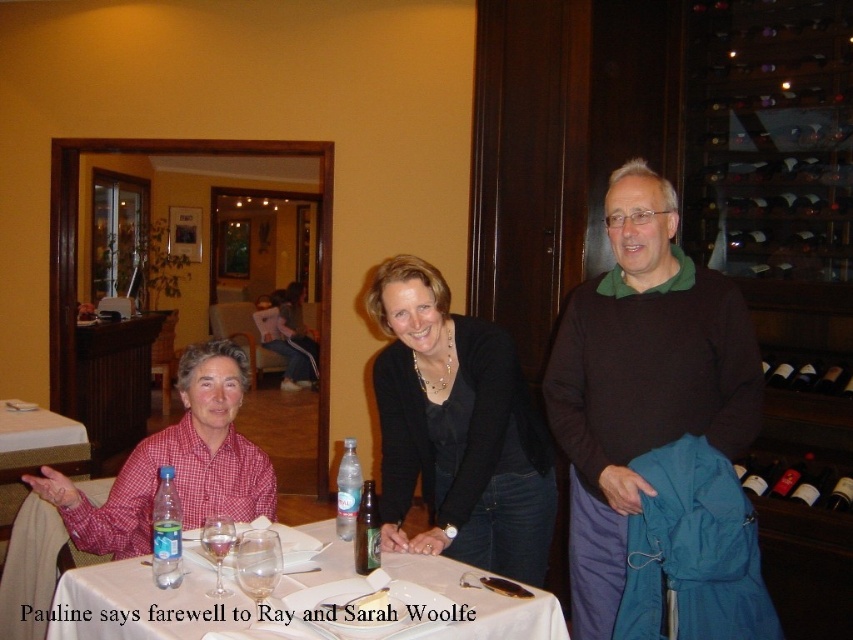
You are standing at the origin point of the coordinate system in the image. You need to walk to point A at point (787, 371) and point B at point (207, 529). Which point is farther away from you?

Point A at point (787, 371) is farther away from you than point B at point (207, 529) because the description states that point (787, 371) is behind point (207, 529).

Consider the image. You are a photographer setting up a shot at this cozy restaurant scene. You need to ensure that the matte black jacket at center and the transparent glass at table center are both in focus. Considering their sizes, which object should you adjust your camera focus on first to ensure depth of field accommodates both?

The matte black jacket at center is taller than the transparent glass at table center, so you should focus on the taller matte black jacket at center first to ensure the depth of field captures both objects effectively.